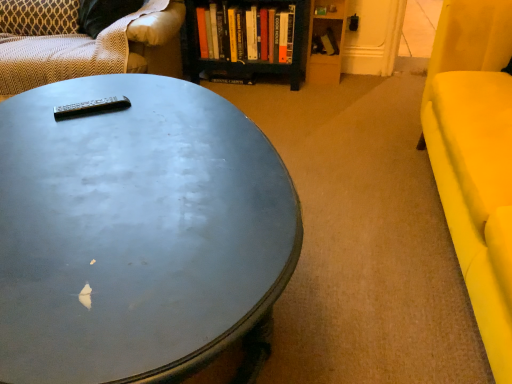
Question: Based on their positions, is patterned fabric studio couch at upper left located to the left or right of matte yellow armchair at right?

Choices:
 (A) right
 (B) left

Answer: (B)

Question: Is patterned fabric studio couch at upper left spatially inside matte yellow armchair at right, or outside of it?

Choices:
 (A) outside
 (B) inside

Answer: (A)

Question: Which object is the closest to the hardcover book at center?

Choices:
 (A) metallic gray coffee table at center
 (B) black plastic remote at center
 (C) patterned fabric pillow at upper left
 (D) patterned fabric studio couch at upper left
 (E) matte yellow armchair at right

Answer: (D)

Question: Which of these objects is positioned farthest from the matte yellow armchair at right?

Choices:
 (A) patterned fabric pillow at upper left
 (B) hardcover book at center
 (C) metallic gray coffee table at center
 (D) patterned fabric studio couch at upper left
 (E) black plastic remote at center

Answer: (A)